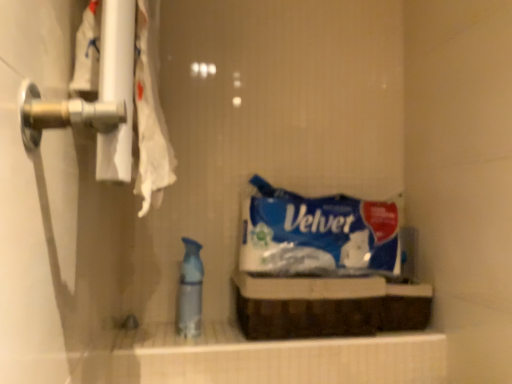
The height and width of the screenshot is (384, 512). I want to click on vacant area situated to the left side of translucent plastic spray bottle at center, so click(x=150, y=337).